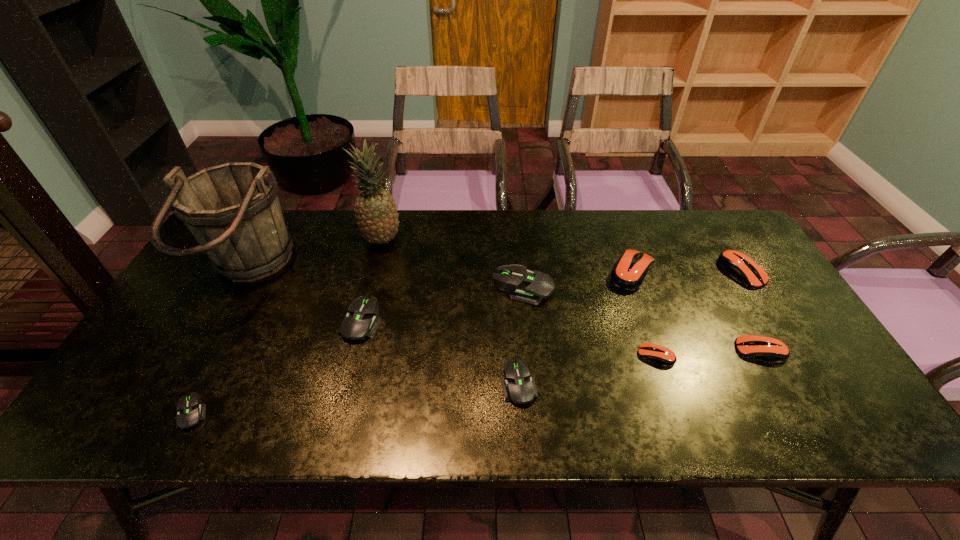
Identify the location of the smallest gray computer mouse. The height and width of the screenshot is (540, 960). (190, 411).

At what (x,y) coordinates should I click in order to perform the action: click on the leftmost gray computer mouse. Please return your answer as a coordinate pair (x, y). Image resolution: width=960 pixels, height=540 pixels. Looking at the image, I should click on (190, 411).

Locate an element on the screen. The width and height of the screenshot is (960, 540). vacant space located 0.350m on the left of the pineapple is located at coordinates (252, 240).

In order to click on free space located on the handle side of the bucket in this screenshot , I will do `click(361, 273)`.

Locate an element on the screen. vacant region located 0.400m on the front of the biggest orange computer mouse is located at coordinates (687, 424).

The image size is (960, 540). I want to click on vacant space located 0.210m on the front of the biggest gray computer mouse, so click(531, 370).

At what (x,y) coordinates should I click in order to perform the action: click on blank space located on the left of the third smallest orange computer mouse. Please return your answer as a coordinate pair (x, y). This screenshot has height=540, width=960. Looking at the image, I should click on (679, 272).

Find the location of a particular element. vacant area situated on the back of the seventh computer mouse from right to left is located at coordinates (386, 222).

This screenshot has height=540, width=960. Identify the location of blank space located on the front of the third biggest orange computer mouse. (804, 429).

Where is `free space located on the back of the second smallest gray computer mouse`? The image size is (960, 540). free space located on the back of the second smallest gray computer mouse is located at coordinates (516, 346).